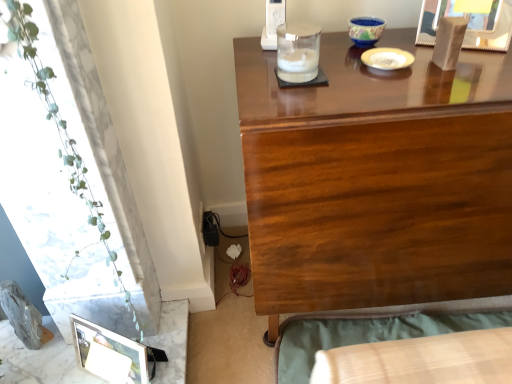
You are a GUI agent. You are given a task and a screenshot of the screen. Output one action in this format:
    pyautogui.click(x=<x>, y=<y>)
    Task: Click on the vacant space that is to the left of wooden picture frame at upper right, the 2th picture frame positioned from the left
    This screenshot has width=512, height=384.
    Given the screenshot: What is the action you would take?
    pyautogui.click(x=400, y=41)